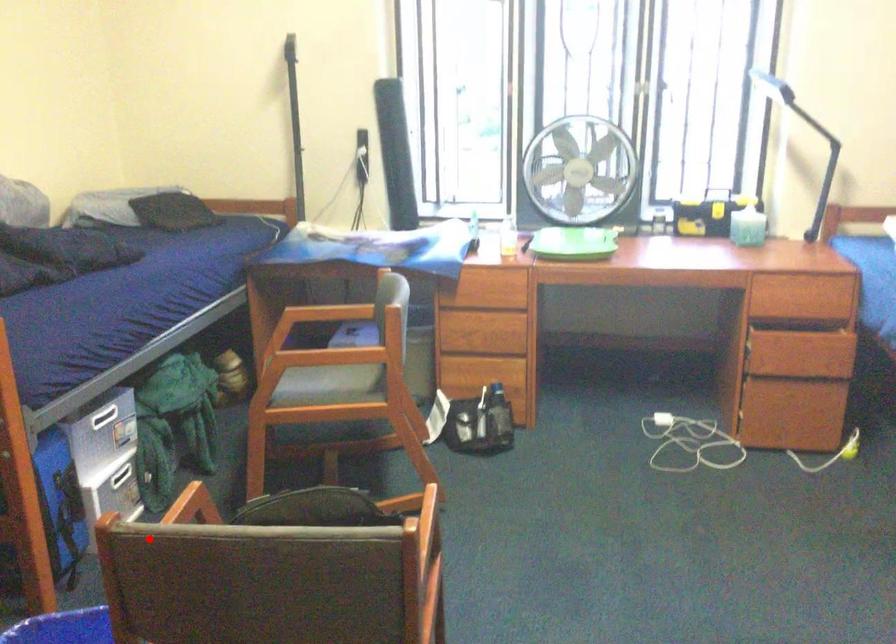
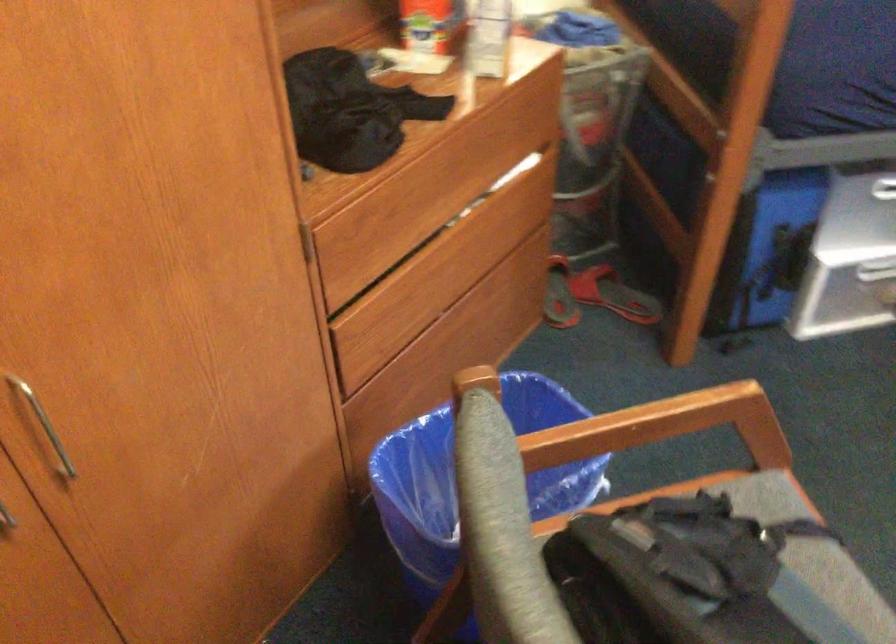
In the second image, find the point that corresponds to the highlighted location in the first image.

(487, 460)